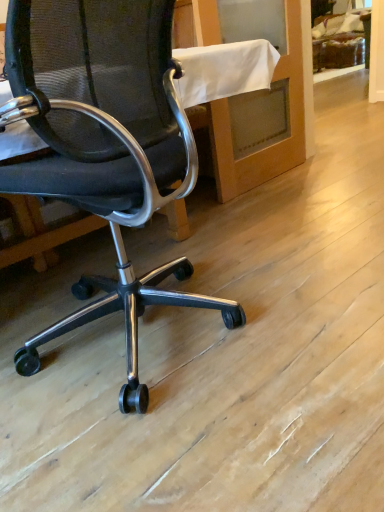
Measure the distance between matte black office chair at left and camera.

The depth of matte black office chair at left is 73.50 centimeters.

Image resolution: width=384 pixels, height=512 pixels. What do you see at coordinates (104, 146) in the screenshot?
I see `matte black office chair at left` at bounding box center [104, 146].

The image size is (384, 512). Identify the location of matte black office chair at left. (104, 146).

At what (x,y) coordinates should I click in order to perform the action: click on matte black office chair at left. Please return your answer as a coordinate pair (x, y). Looking at the image, I should click on (104, 146).